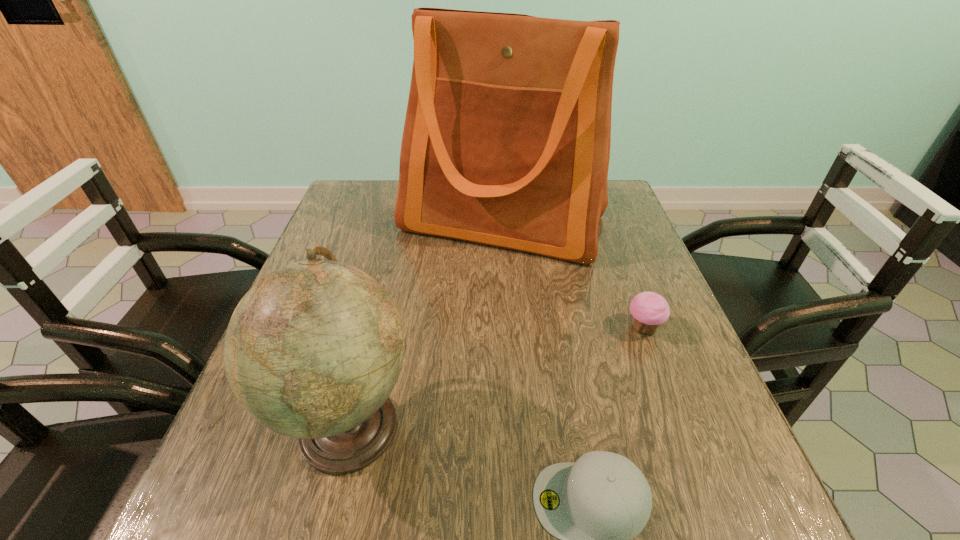
Identify the location of shopping bag. (506, 142).

Where is `the tallest object`? This screenshot has height=540, width=960. the tallest object is located at coordinates (506, 142).

In order to click on the third shortest object in this screenshot , I will do `click(313, 350)`.

This screenshot has width=960, height=540. What are the coordinates of `the third nearest object` in the screenshot? It's located at (649, 310).

Find the location of a particular element. The image size is (960, 540). the second shortest object is located at coordinates (649, 310).

Locate an element on the screen. This screenshot has width=960, height=540. vacant region located on the left of the tallest object is located at coordinates (336, 223).

The width and height of the screenshot is (960, 540). Find the location of `vacant space located 0.100m on the front-facing side of the third shortest object`. vacant space located 0.100m on the front-facing side of the third shortest object is located at coordinates (476, 424).

Locate an element on the screen. vacant space located 0.370m on the left of the cupcake is located at coordinates [x=448, y=328].

Locate an element on the screen. object situated at the far edge is located at coordinates (506, 142).

At what (x,y) coordinates should I click in order to perform the action: click on object that is at the near edge. Please return your answer as a coordinate pair (x, y). The image size is (960, 540). Looking at the image, I should click on (313, 350).